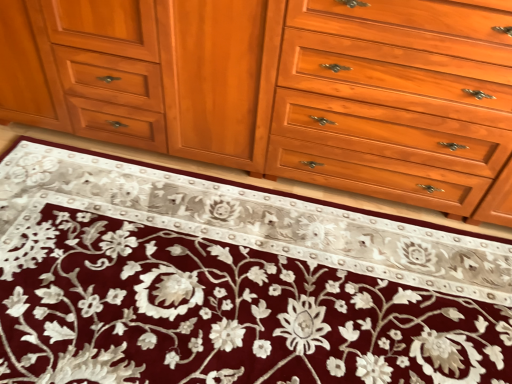
Question: Based on their positions, is maroon velvet rug at center located to the left or right of matte wood cabinet at center?

Choices:
 (A) right
 (B) left

Answer: (A)

Question: From the image's perspective, is maroon velvet rug at center located above or below matte wood cabinet at center?

Choices:
 (A) above
 (B) below

Answer: (B)

Question: Estimate the real-world distances between objects in this image. Which object is farther from the matte wood cabinet at center?

Choices:
 (A) maroon velvet rug at center
 (B) light brown wood drawer at center

Answer: (A)

Question: Estimate the real-world distances between objects in this image. Which object is closer to the light brown wood drawer at center?

Choices:
 (A) matte wood cabinet at center
 (B) maroon velvet rug at center

Answer: (A)